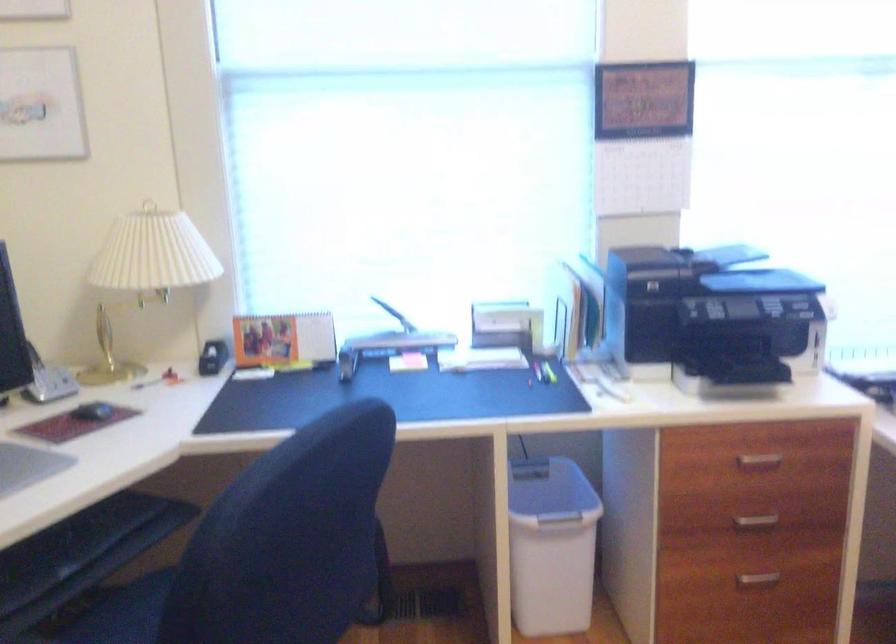
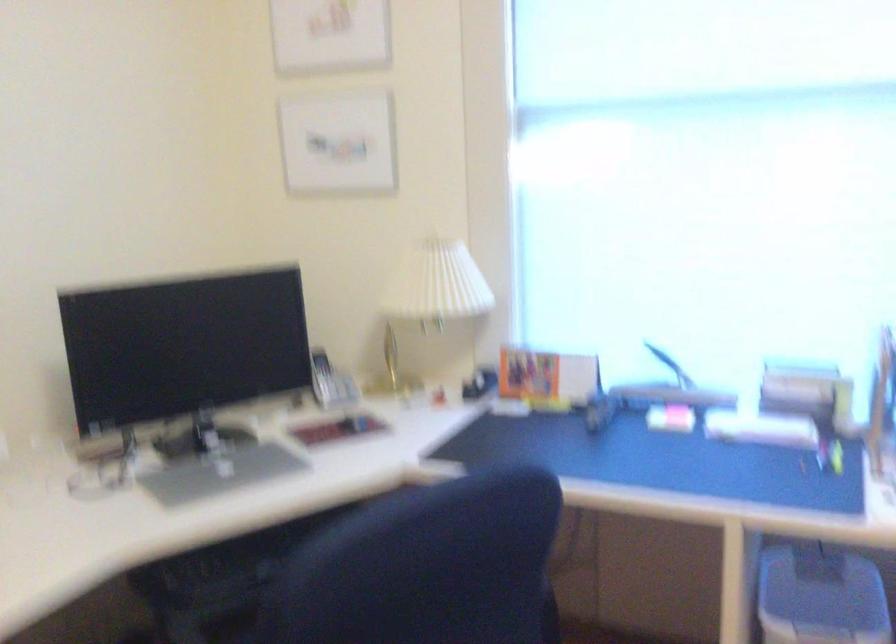
What movement of the cameraman would produce the second image?

The movement direction of the cameraman is right, forward.